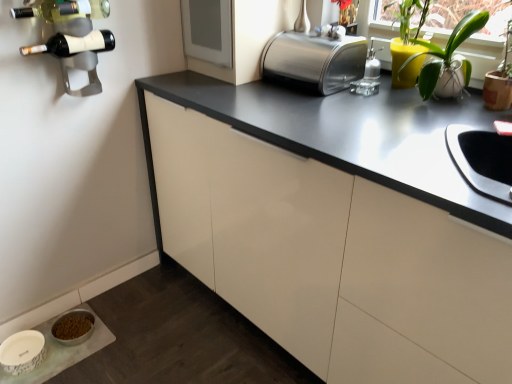
Where is `free area below matte black wine bottle at upper left, arranged as the 1th wine bottle when ordered from the bottom (from a real-world perspective)`? free area below matte black wine bottle at upper left, arranged as the 1th wine bottle when ordered from the bottom (from a real-world perspective) is located at coordinates (111, 287).